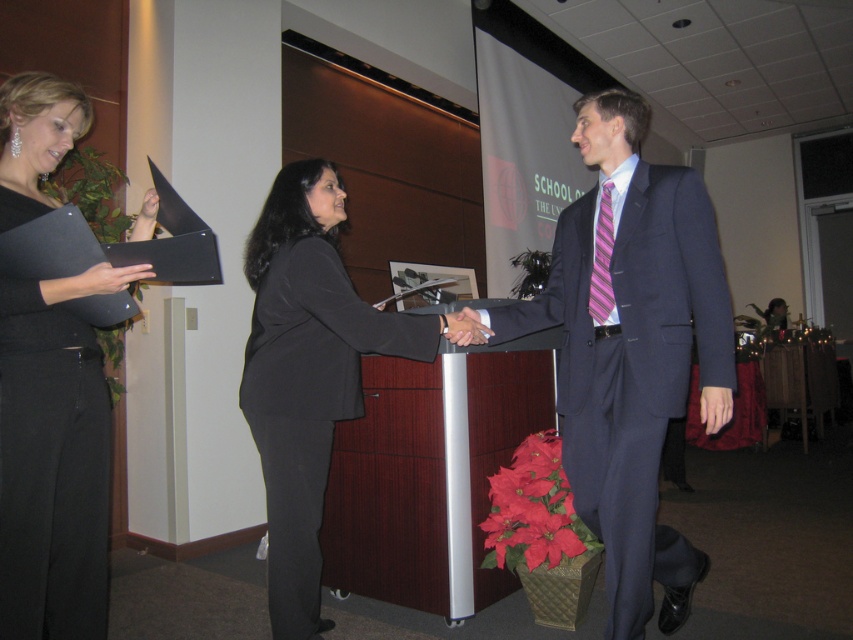
Can you confirm if pink striped tie at center is taller than matte black hand at center?

Yes.

Is point (599, 198) closer to viewer compared to point (450, 317)?

No, (599, 198) is behind (450, 317).

At what (x,y) coordinates should I click in order to perform the action: click on pink striped tie at center. Please return your answer as a coordinate pair (x, y). This screenshot has width=853, height=640. Looking at the image, I should click on (602, 260).

In the scene shown: Between black matte folder at left and matte black hand at center, which one is positioned higher?

matte black hand at center is higher up.

Describe the element at coordinates (51, 468) in the screenshot. I see `black matte folder at left` at that location.

In order to click on black matte folder at left in this screenshot , I will do `click(51, 468)`.

The width and height of the screenshot is (853, 640). Identify the location of black matte folder at left. (51, 468).

Between black matte suit at center and matte black hand at center, which one is positioned lower?

Positioned lower is black matte suit at center.

Where is `black matte suit at center`? This screenshot has width=853, height=640. black matte suit at center is located at coordinates (306, 372).